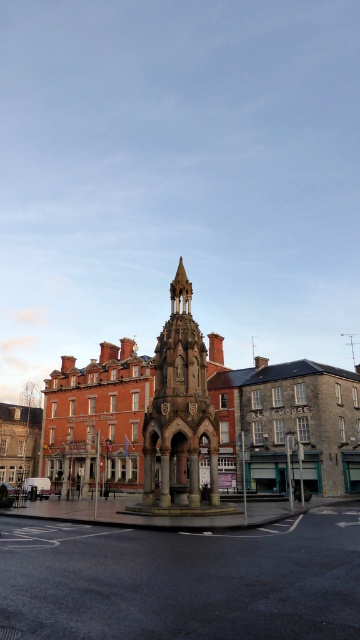
Question: Is stone fountain at center above stone carved bell tower at center?

Choices:
 (A) yes
 (B) no

Answer: (B)

Question: Does stone fountain at center have a larger size compared to stone carved bell tower at center?

Choices:
 (A) no
 (B) yes

Answer: (B)

Question: Which of the following is the farthest from the observer?

Choices:
 (A) stone fountain at center
 (B) stone carved bell tower at center

Answer: (B)

Question: Is stone fountain at center above stone carved bell tower at center?

Choices:
 (A) yes
 (B) no

Answer: (B)